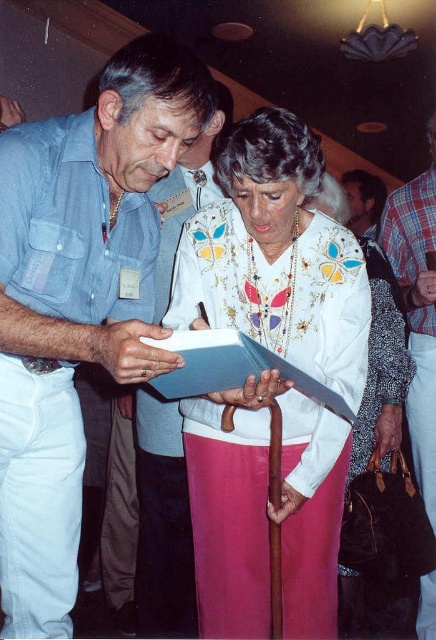
You are an event coordinator at this gathering. You need to check the attendee list on the blue paper clipboard at center. Where should you look relative to the white embroidered blouse at center?

The blue paper clipboard at center is located above the white embroidered blouse at center.

You are a photographer at a social event. You need to take a photo of the white embroidered blouse at center and the blue paper clipboard at center such that the blouse appears to the right of the clipboard in the image. Is this arrangement possible based on the scene?

Yes, because the white embroidered blouse at center is already positioned to the right of the blue paper clipboard at center in the scene.

You are an event organizer at the gathering. You need to decide which clothing item, the plaid fabric shirt at right or the smooth brown leather jacket at upper center, requires more storage space for packing. Based on their sizes, which one should you allocate more space to?

The plaid fabric shirt at right is bigger than the smooth brown leather jacket at upper center, so you should allocate more storage space to the plaid fabric shirt at right.